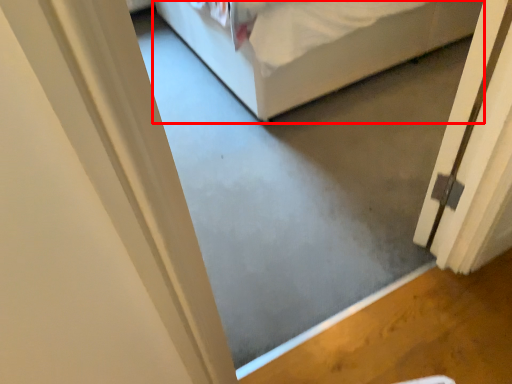
Question: From the image's perspective, where is bed (annotated by the red box) located in relation to door in the image?

Choices:
 (A) below
 (B) above

Answer: (B)